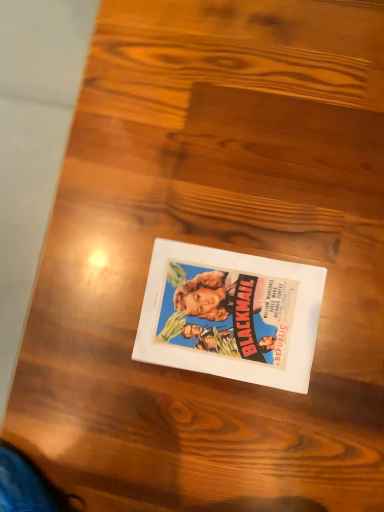
Locate an element on the screen. Image resolution: width=384 pixels, height=512 pixels. vacant space underneath matte paper book at center (from a real-world perspective) is located at coordinates (227, 312).